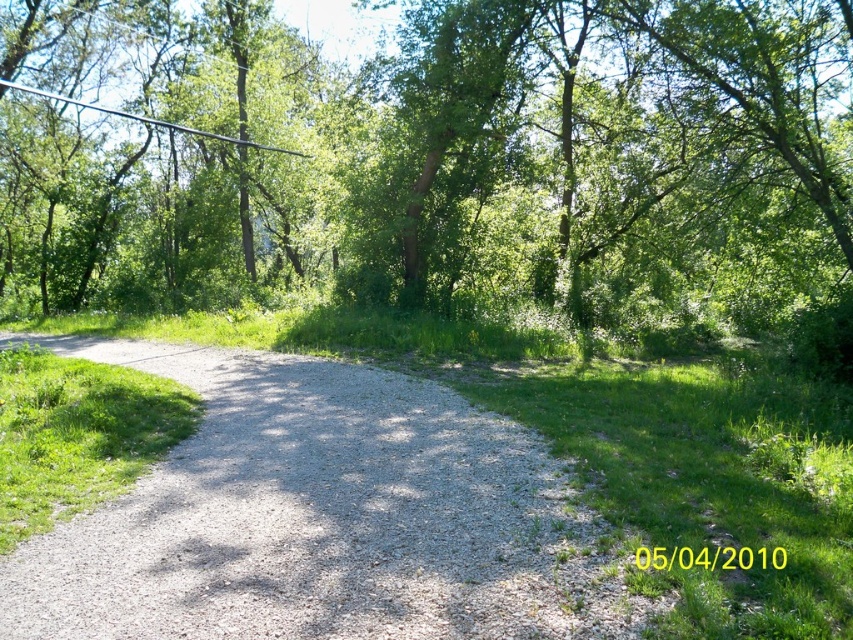
Question: Which point appears closest to the camera in this image?

Choices:
 (A) (273, 362)
 (B) (57, 218)

Answer: (A)

Question: Is green leafy tree at upper center behind metallic wire at upper left?

Choices:
 (A) yes
 (B) no

Answer: (B)

Question: Is green leafy tree at upper center closer to camera compared to metallic wire at upper left?

Choices:
 (A) no
 (B) yes

Answer: (B)

Question: Is gray gravel path at center to the right of metallic wire at upper left from the viewer's perspective?

Choices:
 (A) yes
 (B) no

Answer: (A)

Question: Which object is farther from the camera taking this photo?

Choices:
 (A) gray gravel path at center
 (B) green leafy tree at upper center

Answer: (B)

Question: Estimate the real-world distances between objects in this image. Which object is closer to the gray gravel path at center?

Choices:
 (A) metallic wire at upper left
 (B) green leafy tree at upper center

Answer: (B)